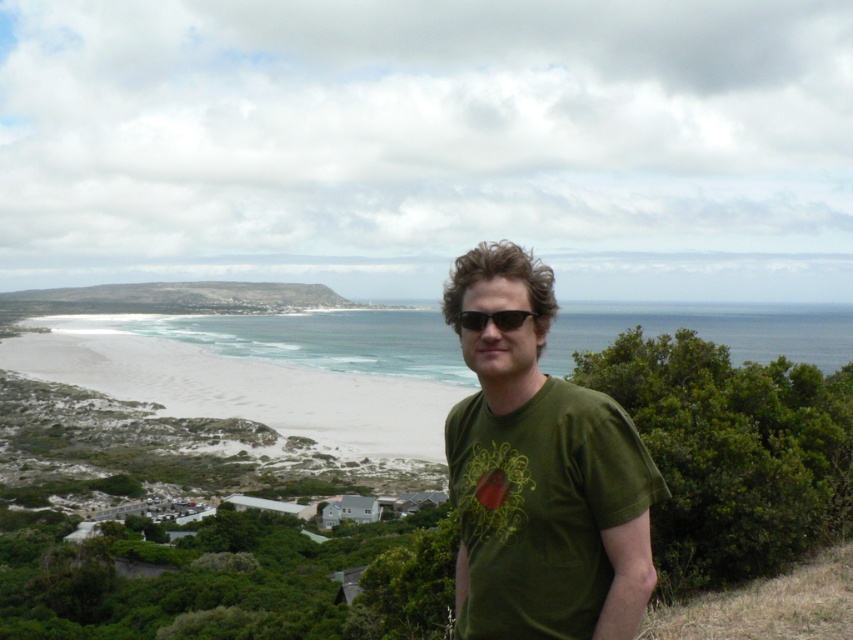
You are a photographer trying to capture a clear shot of the black plastic sunglasses at center and the green grassy hillside at center. Which object should you focus on first to ensure both are in focus?

The black plastic sunglasses at center is behind the green grassy hillside at center, so you should focus on the green grassy hillside at center first to ensure both are in focus.

You are standing at the point with coordinates point (581, 502) and want to walk towards the point with coordinates point (80, 300). Which direction should you face to move towards it?

Since point (581, 502) is closer to the viewer than point (80, 300), you should face towards the lower right direction to move towards it.